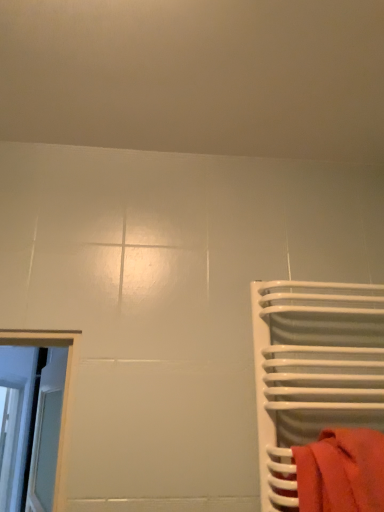
Question: From the image's perspective, is white glossy towel rack at right above or below matte red towel at right?

Choices:
 (A) above
 (B) below

Answer: (A)

Question: From their relative heights in the image, would you say white glossy towel rack at right is taller or shorter than matte red towel at right?

Choices:
 (A) short
 (B) tall

Answer: (B)

Question: Is point (284, 306) closer or farther from the camera than point (382, 493)?

Choices:
 (A) closer
 (B) farther

Answer: (B)

Question: From a real-world perspective, is matte red towel at right physically located above or below white glossy towel rack at right?

Choices:
 (A) below
 (B) above

Answer: (A)

Question: Is matte red towel at right to the left or to the right of white glossy towel rack at right in the image?

Choices:
 (A) left
 (B) right

Answer: (A)

Question: Is matte red towel at right situated inside white glossy towel rack at right or outside?

Choices:
 (A) inside
 (B) outside

Answer: (A)

Question: From the image's perspective, relative to white glossy towel rack at right, is matte red towel at right above or below?

Choices:
 (A) above
 (B) below

Answer: (B)